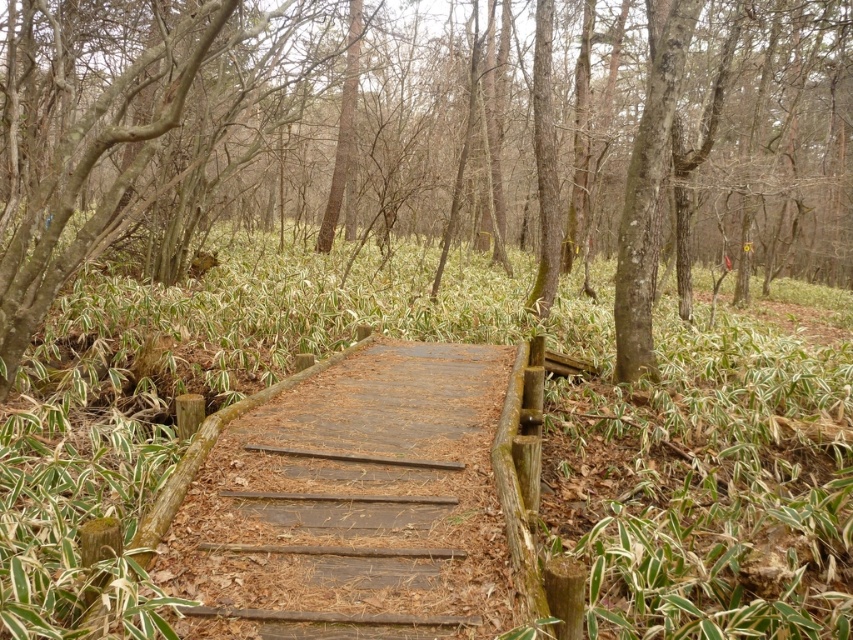
In the scene shown: You are a hiker who wants to cross the brown wood bridge at center. You notice the weathered wood path at center is below it. Can you step directly from the bridge onto the path without needing to climb or jump?

The brown wood bridge at center is taller than the weathered wood path at center, so you would need to climb or jump down from the bridge to reach the path.

You are a hiker standing on the weathered wood path at center and want to take a photo of the green leafy plants at center. Since the plants are much taller than the path, will you need to adjust your camera angle upwards to capture them in the frame?

Yes, you will need to adjust your camera angle upwards to capture the green leafy plants at center because they are much taller than the weathered wood path at center.

You are a hiker carrying a heavy backpack and need to cross the brown wood bridge at center. Considering the green leafy plants at center nearby, which object is bigger in size?

The brown wood bridge at center has a larger size compared to the green leafy plants at center, so the bridge is bigger.